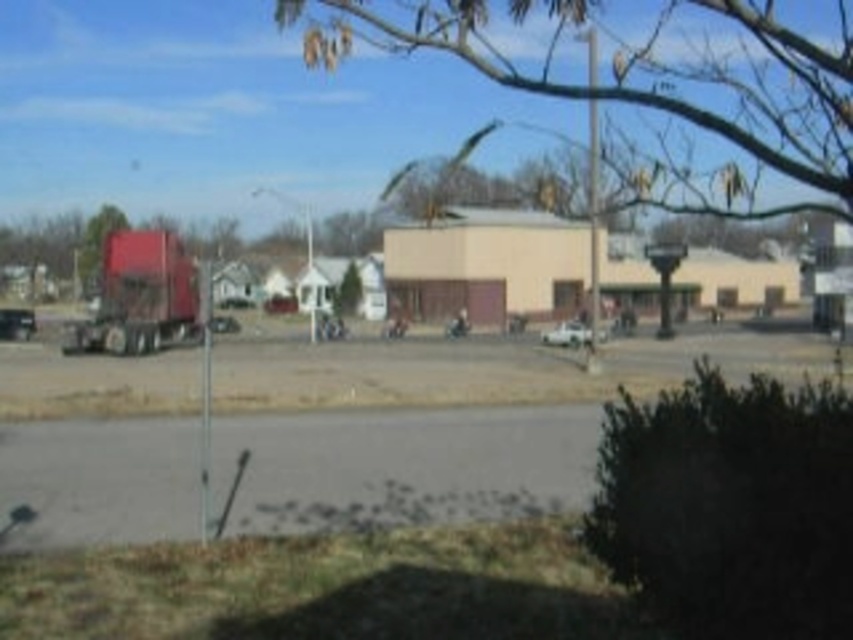
Can you confirm if dark green bush at lower right is positioned below metallic silver truck at left?

Actually, dark green bush at lower right is above metallic silver truck at left.

Consider the image. Which is above, dark green bush at lower right or metallic silver truck at left?

dark green bush at lower right

Where is `dark green bush at lower right`? This screenshot has height=640, width=853. dark green bush at lower right is located at coordinates (730, 508).

I want to click on dark green bush at lower right, so click(730, 508).

Does point (585, 339) come behind point (4, 310)?

That is False.

Can you confirm if white matte car at center is bigger than metallic silver truck at left?

No, white matte car at center is not bigger than metallic silver truck at left.

Find the location of a particular element. white matte car at center is located at coordinates (567, 333).

Between dark green bush at lower right and metallic silver car at center, which one is positioned higher?

metallic silver car at center is higher up.

Is dark green bush at lower right further to camera compared to metallic silver car at center?

That is False.

The image size is (853, 640). Describe the element at coordinates (730, 508) in the screenshot. I see `dark green bush at lower right` at that location.

You are a GUI agent. You are given a task and a screenshot of the screen. Output one action in this format:
    pyautogui.click(x=<x>, y=<y>)
    Task: Click on the dark green bush at lower right
    
    Given the screenshot: What is the action you would take?
    click(730, 508)